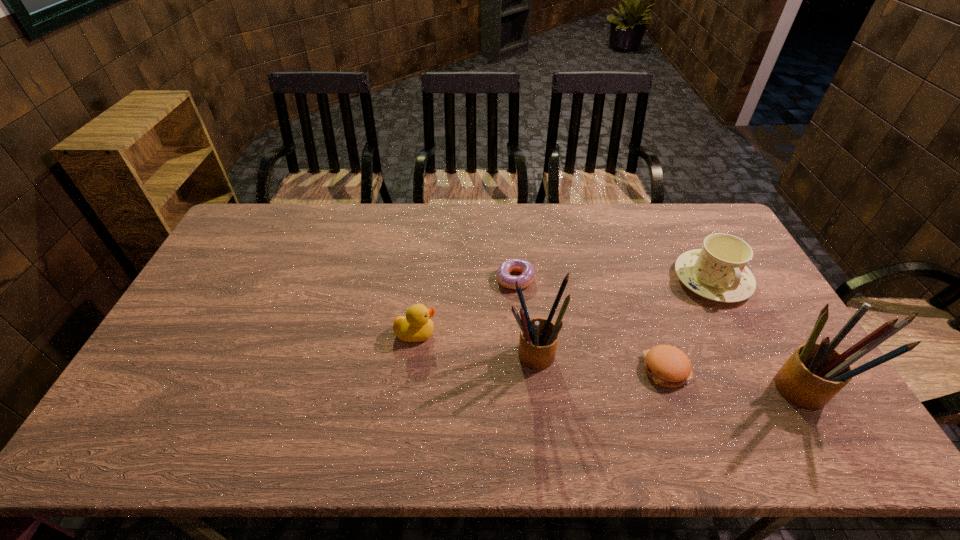
The height and width of the screenshot is (540, 960). In order to click on free space between the doughnut and the leftmost object in this screenshot , I will do `click(466, 306)`.

Locate an element on the screen. unoccupied area between the fourth object from left to right and the second tallest object is located at coordinates (599, 362).

At what (x,y) coordinates should I click in order to perform the action: click on vacant area between the left pencil box and the leftmost object. Please return your answer as a coordinate pair (x, y). The image size is (960, 540). Looking at the image, I should click on (475, 343).

In order to click on object that is the third closest to the taller pencil box in this screenshot , I will do `click(538, 341)`.

I want to click on the fifth closest object to the chinaware, so [416, 326].

This screenshot has height=540, width=960. In order to click on free region that satisfies the following two spatial constraints: 1. on the face of the duckling; 2. on the right side of the shorter pencil box in this screenshot , I will do `click(414, 354)`.

You are a GUI agent. You are given a task and a screenshot of the screen. Output one action in this format:
    pyautogui.click(x=<x>, y=<y>)
    Task: Click on the vacant space that satisfies the following two spatial constraints: 1. on the back side of the left pencil box; 2. on the face of the duckling
    
    Given the screenshot: What is the action you would take?
    pyautogui.click(x=532, y=334)

The height and width of the screenshot is (540, 960). Find the location of `vacant region that satisfies the following two spatial constraints: 1. on the face of the fourth object from left to right; 2. on the right side of the duckling`. vacant region that satisfies the following two spatial constraints: 1. on the face of the fourth object from left to right; 2. on the right side of the duckling is located at coordinates 411,370.

Locate an element on the screen. The height and width of the screenshot is (540, 960). vacant space that satisfies the following two spatial constraints: 1. on the face of the duckling; 2. on the left side of the left pencil box is located at coordinates (414, 354).

Image resolution: width=960 pixels, height=540 pixels. What are the coordinates of `free space that satisfies the following two spatial constraints: 1. on the front side of the third object from right to left; 2. on the right side of the left pencil box` in the screenshot? It's located at (536, 370).